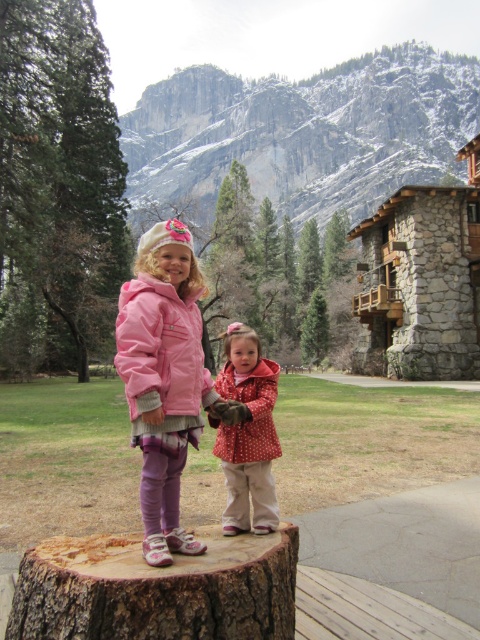
Is pink fleece jacket at center bigger than matte pink jacket at center?

Indeed, pink fleece jacket at center has a larger size compared to matte pink jacket at center.

Who is positioned more to the right, pink fleece jacket at center or matte pink jacket at center?

matte pink jacket at center is more to the right.

Between point (156, 451) and point (187, 305), which one is positioned behind?

Point (187, 305)

At what (x,y) coordinates should I click in order to perform the action: click on pink fleece jacket at center. Please return your answer as a coordinate pair (x, y). The image size is (480, 640). Looking at the image, I should click on (164, 378).

Is matte pink jacket at center above polka dot fabric coat at center?

Yes.

Which is above, matte pink jacket at center or polka dot fabric coat at center?

matte pink jacket at center is higher up.

Is point (132, 403) farther from viewer compared to point (268, 426)?

No, (132, 403) is closer to viewer.

Where is `matte pink jacket at center`? The image size is (480, 640). matte pink jacket at center is located at coordinates (160, 349).

Who is positioned more to the left, brown rough tree stump at lower center or matte pink jacket at center?

From the viewer's perspective, matte pink jacket at center appears more on the left side.

Does point (62, 609) lie behind point (167, 317)?

No.

Image resolution: width=480 pixels, height=640 pixels. Find the location of `brown rough tree stump at lower center`. brown rough tree stump at lower center is located at coordinates (156, 589).